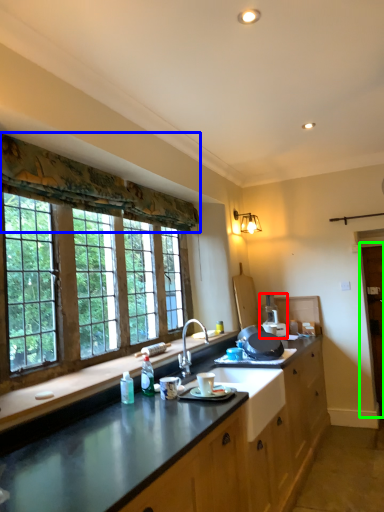
Question: Estimate the real-world distances between objects in this image. Which object is closer to appliance (highlighted by a red box), curtain (highlighted by a blue box) or barn door (highlighted by a green box)?

Choices:
 (A) curtain
 (B) barn door

Answer: (B)